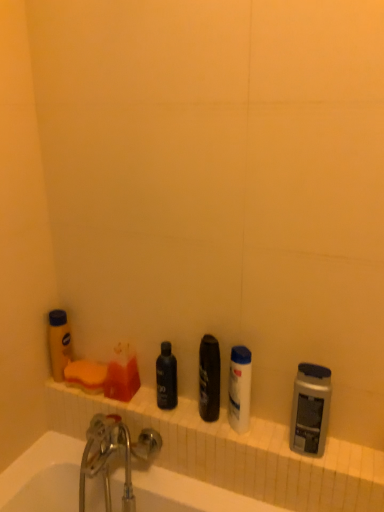
The image size is (384, 512). Describe the element at coordinates (239, 388) in the screenshot. I see `white plastic mouthwash at center` at that location.

Based on the photo, what is the approximate width of white ceramic bathtub at lower left?

28.51 centimeters.

You are a GUI agent. You are given a task and a screenshot of the screen. Output one action in this format:
    pyautogui.click(x=<x>, y=<y>)
    Task: Click on the metallic gray shaver at right, marked as the fifth toiletry in a left-to-right arrangement
    
    Given the screenshot: What is the action you would take?
    pyautogui.click(x=310, y=409)

Locate an element on the screen. The height and width of the screenshot is (512, 384). translucent plastic soap at upper left, the 2th toiletry in the left-to-right sequence is located at coordinates (122, 374).

What do you see at coordinates (59, 343) in the screenshot? Image resolution: width=384 pixels, height=512 pixels. I see `yellow matte bottle at left, marked as the 1th toiletry in a left-to-right arrangement` at bounding box center [59, 343].

The height and width of the screenshot is (512, 384). Describe the element at coordinates (209, 378) in the screenshot. I see `shiny black can at center, which is the 2th toiletry from right to left` at that location.

This screenshot has height=512, width=384. Describe the element at coordinates (226, 447) in the screenshot. I see `white ceramic ledge at lower center` at that location.

At what (x,y) coordinates should I click in order to perform the action: click on white plastic mouthwash at center. Please return your answer as a coordinate pair (x, y). Image resolution: width=384 pixels, height=512 pixels. Looking at the image, I should click on (239, 388).

Choose the correct answer: Is yellow matte bottle at left, the 5th toiletry when ordered from right to left, inside translucent plastic soap at upper left, the 2th toiletry in the left-to-right sequence, or outside it?

yellow matte bottle at left, the 5th toiletry when ordered from right to left, is not inside translucent plastic soap at upper left, the 2th toiletry in the left-to-right sequence, it's outside.

Between yellow matte bottle at left, marked as the 1th toiletry in a left-to-right arrangement, and translucent plastic soap at upper left, which is counted as the fourth toiletry, starting from the right, which one has more height?

yellow matte bottle at left, marked as the 1th toiletry in a left-to-right arrangement.

This screenshot has height=512, width=384. I want to click on the 3rd toiletry below when counting from the yellow matte bottle at left, marked as the 1th toiletry in a left-to-right arrangement (from the image's perspective), so click(122, 374).

Who is more distant, white ceramic ledge at lower center or shiny black can at center, which is the 2th toiletry from right to left?

Positioned behind is shiny black can at center, which is the 2th toiletry from right to left.

What's the angular difference between white ceramic ledge at lower center and shiny black can at center, which is the 2th toiletry from right to left,'s facing directions?

The angular difference between white ceramic ledge at lower center and shiny black can at center, which is the 2th toiletry from right to left, is 0.163 degrees.

From a real-world perspective, who is located lower, white ceramic ledge at lower center or shiny black can at center, placed as the fourth toiletry when sorted from left to right?

From a 3D spatial view, white ceramic ledge at lower center is below.

Is white ceramic ledge at lower center far away from shiny black can at center, which is the 2th toiletry from right to left?

That's not correct — white ceramic ledge at lower center is a little close to shiny black can at center, which is the 2th toiletry from right to left.

Where is `ledge located below the translucent plastic soap at upper left, which is counted as the fourth toiletry, starting from the right (from the image's perspective)`? ledge located below the translucent plastic soap at upper left, which is counted as the fourth toiletry, starting from the right (from the image's perspective) is located at coordinates (226, 447).

Considering the relative sizes of translucent plastic soap at upper left, which is counted as the fourth toiletry, starting from the right, and white ceramic ledge at lower center in the image provided, is translucent plastic soap at upper left, which is counted as the fourth toiletry, starting from the right, thinner than white ceramic ledge at lower center?

Yes, translucent plastic soap at upper left, which is counted as the fourth toiletry, starting from the right, is thinner than white ceramic ledge at lower center.

From the image's perspective, is translucent plastic soap at upper left, which is counted as the fourth toiletry, starting from the right, on top of white ceramic ledge at lower center?

Indeed, from the image's perspective, translucent plastic soap at upper left, which is counted as the fourth toiletry, starting from the right, is shown above white ceramic ledge at lower center.

How far apart are translucent plastic soap at upper left, the 2th toiletry in the left-to-right sequence, and white ceramic ledge at lower center?

They are 10.00 inches apart.

Between yellow matte bottle at left, marked as the 1th toiletry in a left-to-right arrangement, and shiny black can at center, which is the 2th toiletry from right to left, which one has smaller size?

yellow matte bottle at left, marked as the 1th toiletry in a left-to-right arrangement, is smaller.

You are a GUI agent. You are given a task and a screenshot of the screen. Output one action in this format:
    pyautogui.click(x=<x>, y=<y>)
    Task: Click on the toiletry that is the 1st one when counting downward from the yellow matte bottle at left, marked as the 1th toiletry in a left-to-right arrangement (from the image's perspective)
    The height and width of the screenshot is (512, 384).
    Given the screenshot: What is the action you would take?
    pyautogui.click(x=209, y=378)

Is yellow matte bottle at left, the 5th toiletry when ordered from right to left, touching shiny black can at center, placed as the fourth toiletry when sorted from left to right?

No, yellow matte bottle at left, the 5th toiletry when ordered from right to left, is not next to shiny black can at center, placed as the fourth toiletry when sorted from left to right.

Which is in front, yellow matte bottle at left, the 5th toiletry when ordered from right to left, or shiny black can at center, which is the 2th toiletry from right to left?

shiny black can at center, which is the 2th toiletry from right to left, is closer to the camera.

Looking at this image, considering the positions of objects shiny black can at center, placed as the fourth toiletry when sorted from left to right, and black matte bottle at center, which is the third toiletry in left-to-right order, in the image provided, who is more to the left, shiny black can at center, placed as the fourth toiletry when sorted from left to right, or black matte bottle at center, which is the third toiletry in left-to-right order,?

Positioned to the left is black matte bottle at center, which is the third toiletry in left-to-right order.

Is shiny black can at center, placed as the fourth toiletry when sorted from left to right, not close to black matte bottle at center, which is the third toiletry in left-to-right order?

No, there isn't a large distance between shiny black can at center, placed as the fourth toiletry when sorted from left to right, and black matte bottle at center, which is the third toiletry in left-to-right order.

Is shiny black can at center, which is the 2th toiletry from right to left, aimed at black matte bottle at center, marked as the 3th toiletry in a right-to-left arrangement?

No, shiny black can at center, which is the 2th toiletry from right to left, is not facing towards black matte bottle at center, marked as the 3th toiletry in a right-to-left arrangement.

Between metallic gray shaver at right, the first toiletry in the right-to-left sequence, and yellow matte bottle at left, marked as the 1th toiletry in a left-to-right arrangement, which one has smaller size?

Smaller between the two is yellow matte bottle at left, marked as the 1th toiletry in a left-to-right arrangement.

Is point (299, 438) positioned before point (56, 370)?

That is True.

Looking at their sizes, would you say metallic gray shaver at right, marked as the fifth toiletry in a left-to-right arrangement, is wider or thinner than yellow matte bottle at left, marked as the 1th toiletry in a left-to-right arrangement?

Clearly, metallic gray shaver at right, marked as the fifth toiletry in a left-to-right arrangement, has more width compared to yellow matte bottle at left, marked as the 1th toiletry in a left-to-right arrangement.

From a real-world perspective, who is located lower, metallic gray shaver at right, the first toiletry in the right-to-left sequence, or yellow matte bottle at left, the 5th toiletry when ordered from right to left?

yellow matte bottle at left, the 5th toiletry when ordered from right to left.

Can you confirm if white plastic mouthwash at center is thinner than yellow matte bottle at left, marked as the 1th toiletry in a left-to-right arrangement?

Correct, the width of white plastic mouthwash at center is less than that of yellow matte bottle at left, marked as the 1th toiletry in a left-to-right arrangement.

Is white plastic mouthwash at center smaller than yellow matte bottle at left, the 5th toiletry when ordered from right to left?

No, white plastic mouthwash at center is not smaller than yellow matte bottle at left, the 5th toiletry when ordered from right to left.

From a real-world perspective, who is located lower, white plastic mouthwash at center or yellow matte bottle at left, marked as the 1th toiletry in a left-to-right arrangement?

From a 3D spatial view, yellow matte bottle at left, marked as the 1th toiletry in a left-to-right arrangement, is below.

The height and width of the screenshot is (512, 384). What are the coordinates of `the 2nd toiletry located above the translucent plastic soap at upper left, which is counted as the fourth toiletry, starting from the right (from a real-world perspective)` in the screenshot? It's located at (59, 343).

This screenshot has height=512, width=384. In order to click on ledge that appears on the left of shiny black can at center, placed as the fourth toiletry when sorted from left to right in this screenshot , I will do `click(226, 447)`.

Looking at the image, which one is located further to white ceramic ledge at lower center, white ceramic bathtub at lower left or shiny black can at center, which is the 2th toiletry from right to left?

shiny black can at center, which is the 2th toiletry from right to left, is further to white ceramic ledge at lower center.

From the image, which object appears to be nearer to translucent plastic soap at upper left, the 2th toiletry in the left-to-right sequence, white plastic mouthwash at center or shiny black can at center, which is the 2th toiletry from right to left?

Among the two, shiny black can at center, which is the 2th toiletry from right to left, is located nearer to translucent plastic soap at upper left, the 2th toiletry in the left-to-right sequence.

Looking at this image, considering their positions, is shiny black can at center, placed as the fourth toiletry when sorted from left to right, positioned further to white ceramic ledge at lower center than white plastic mouthwash at center?

The object further to white ceramic ledge at lower center is shiny black can at center, placed as the fourth toiletry when sorted from left to right.

Estimate the real-world distances between objects in this image. Which object is further from shiny black can at center, placed as the fourth toiletry when sorted from left to right, black matte bottle at center, which is the third toiletry in left-to-right order, or yellow matte bottle at left, marked as the 1th toiletry in a left-to-right arrangement?

The object further to shiny black can at center, placed as the fourth toiletry when sorted from left to right, is yellow matte bottle at left, marked as the 1th toiletry in a left-to-right arrangement.

Consider the image. Which object lies nearer to the anchor point metallic gray shaver at right, marked as the fifth toiletry in a left-to-right arrangement, white ceramic bathtub at lower left or shiny black can at center, placed as the fourth toiletry when sorted from left to right?

The object closer to metallic gray shaver at right, marked as the fifth toiletry in a left-to-right arrangement, is shiny black can at center, placed as the fourth toiletry when sorted from left to right.

Which object lies further to the anchor point white plastic mouthwash at center, shiny black can at center, placed as the fourth toiletry when sorted from left to right, or yellow matte bottle at left, marked as the 1th toiletry in a left-to-right arrangement?

yellow matte bottle at left, marked as the 1th toiletry in a left-to-right arrangement.

When comparing their distances from shiny black can at center, placed as the fourth toiletry when sorted from left to right, does white ceramic bathtub at lower left or black matte bottle at center, which is the third toiletry in left-to-right order, seem further?

Based on the image, white ceramic bathtub at lower left appears to be further to shiny black can at center, placed as the fourth toiletry when sorted from left to right.

When comparing their distances from metallic gray shaver at right, marked as the fifth toiletry in a left-to-right arrangement, does black matte bottle at center, which is the third toiletry in left-to-right order, or white ceramic ledge at lower center seem closer?

white ceramic ledge at lower center lies closer to metallic gray shaver at right, marked as the fifth toiletry in a left-to-right arrangement, than the other object.

Find the location of a particular element. The height and width of the screenshot is (512, 384). mouthwash that lies between shiny black can at center, placed as the fourth toiletry when sorted from left to right, and white ceramic ledge at lower center from top to bottom is located at coordinates (239, 388).

I want to click on bathtub situated between yellow matte bottle at left, the 5th toiletry when ordered from right to left, and shiny black can at center, placed as the fourth toiletry when sorted from left to right, from left to right, so click(x=43, y=476).

Locate an element on the screen. ledge located between yellow matte bottle at left, marked as the 1th toiletry in a left-to-right arrangement, and shiny black can at center, which is the 2th toiletry from right to left, in the left-right direction is located at coordinates (226, 447).

At what (x,y) coordinates should I click in order to perform the action: click on ledge between yellow matte bottle at left, marked as the 1th toiletry in a left-to-right arrangement, and metallic gray shaver at right, marked as the fifth toiletry in a left-to-right arrangement, from left to right. Please return your answer as a coordinate pair (x, y). Looking at the image, I should click on (226, 447).